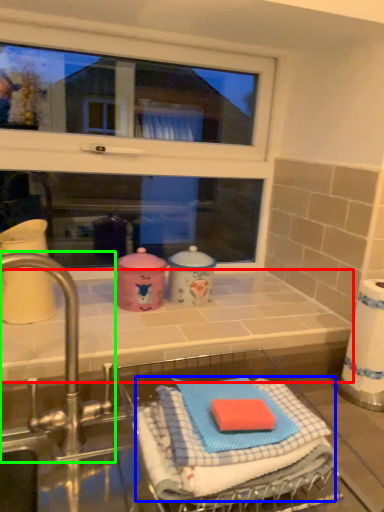
Question: Which object is the farthest from counter top (highlighted by a red box)? Choose among these: bath towel (highlighted by a blue box) or tap (highlighted by a green box).

Choices:
 (A) bath towel
 (B) tap

Answer: (A)